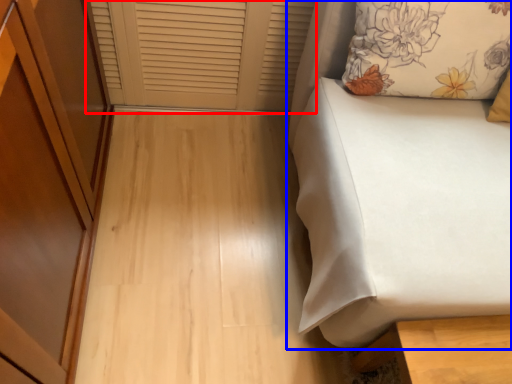
Question: Which of the following is the closest to the observer, window frame (highlighted by a red box) or furniture (highlighted by a blue box)?

Choices:
 (A) window frame
 (B) furniture

Answer: (B)